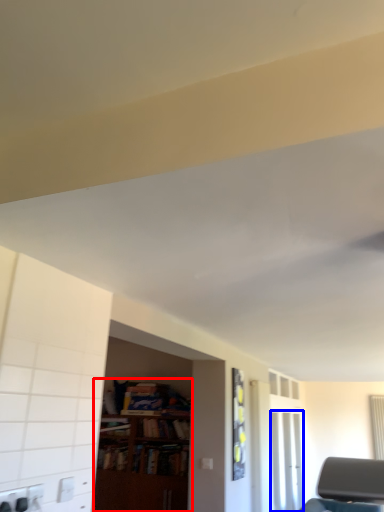
Question: Which of the following is the closest to the observer, bookcase (highlighted by a red box) or glass door (highlighted by a blue box)?

Choices:
 (A) bookcase
 (B) glass door

Answer: (A)